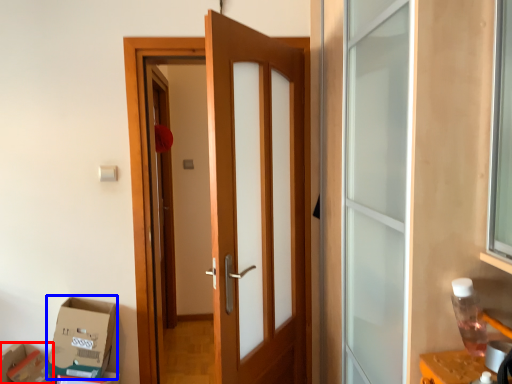
Question: Which object appears closest to the camera in this image, cardboard box (highlighted by a red box) or cardboard box (highlighted by a blue box)?

Choices:
 (A) cardboard box
 (B) cardboard box

Answer: (B)